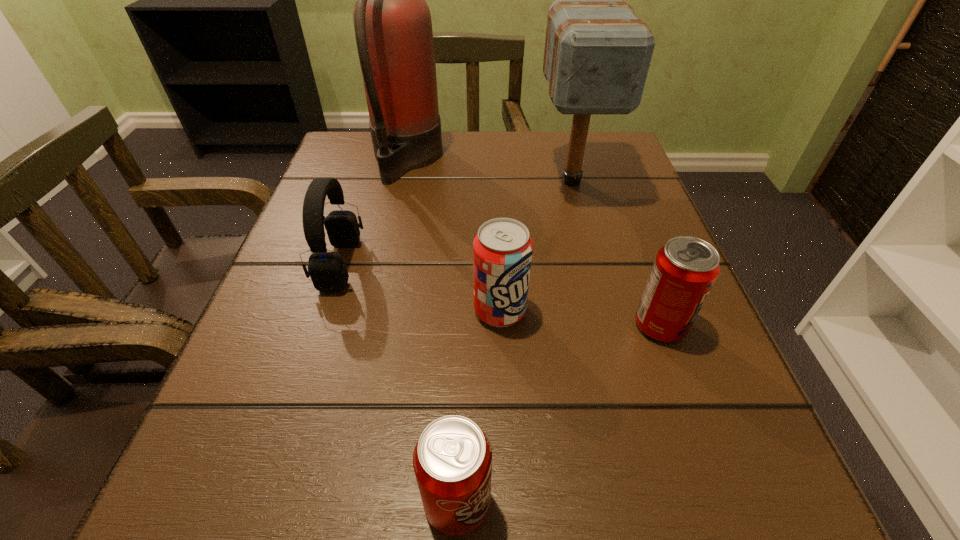
This screenshot has height=540, width=960. I want to click on fire extinguisher that is at the left edge, so click(392, 21).

The width and height of the screenshot is (960, 540). What are the coordinates of `headset present at the left edge` in the screenshot? It's located at (328, 272).

Image resolution: width=960 pixels, height=540 pixels. What are the coordinates of `mallet that is positioned at the right edge` in the screenshot? It's located at (597, 54).

The height and width of the screenshot is (540, 960). In order to click on soda can that is positioned at the right edge in this screenshot , I will do `click(685, 269)`.

Locate an element on the screen. object that is at the far left corner is located at coordinates (392, 21).

What are the coordinates of `object positioned at the far right corner` in the screenshot? It's located at (597, 54).

Find the location of a particular element. This screenshot has width=960, height=540. vacant space at the far edge of the desktop is located at coordinates (545, 168).

This screenshot has width=960, height=540. In the image, there is a desktop. In order to click on vacant space at the near edge in this screenshot , I will do `click(513, 507)`.

In the image, there is a desktop. Where is `free space at the left edge`? free space at the left edge is located at coordinates (205, 418).

Find the location of a particular element. The width and height of the screenshot is (960, 540). vacant space at the right edge of the desktop is located at coordinates (593, 260).